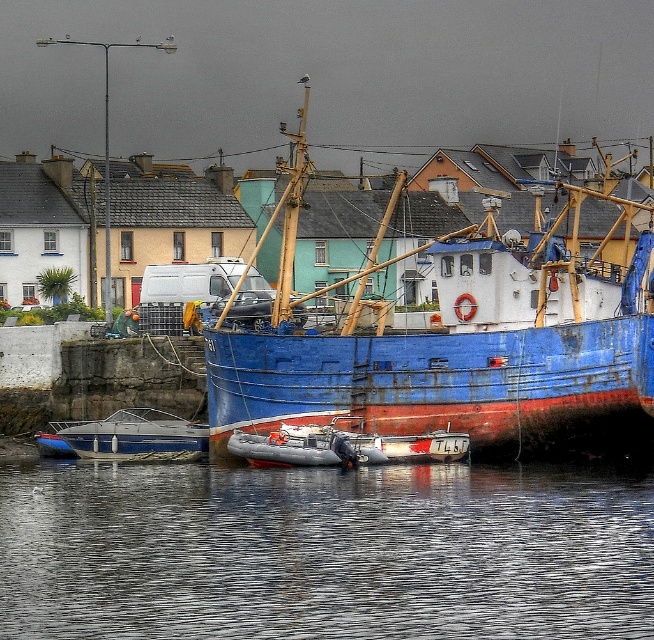
Question: In this image, where is smooth water at lower center located relative to metallic gray dinghy at lower left?

Choices:
 (A) below
 (B) above

Answer: (A)

Question: Which object appears farthest from the camera in this image?

Choices:
 (A) blue painted wooden boat at center
 (B) metallic gray dinghy at lower left

Answer: (B)

Question: Is smooth water at lower center positioned behind metallic gray dinghy at lower left?

Choices:
 (A) no
 (B) yes

Answer: (A)

Question: Which of the following is the farthest from the observer?

Choices:
 (A) metallic gray dinghy at lower left
 (B) blue painted wooden boat at center

Answer: (A)

Question: Is blue painted wooden boat at center wider than metallic gray dinghy at lower left?

Choices:
 (A) yes
 (B) no

Answer: (A)

Question: Which object appears closest to the camera in this image?

Choices:
 (A) blue painted wooden boat at center
 (B) smooth water at lower center
 (C) metallic gray dinghy at lower left

Answer: (B)